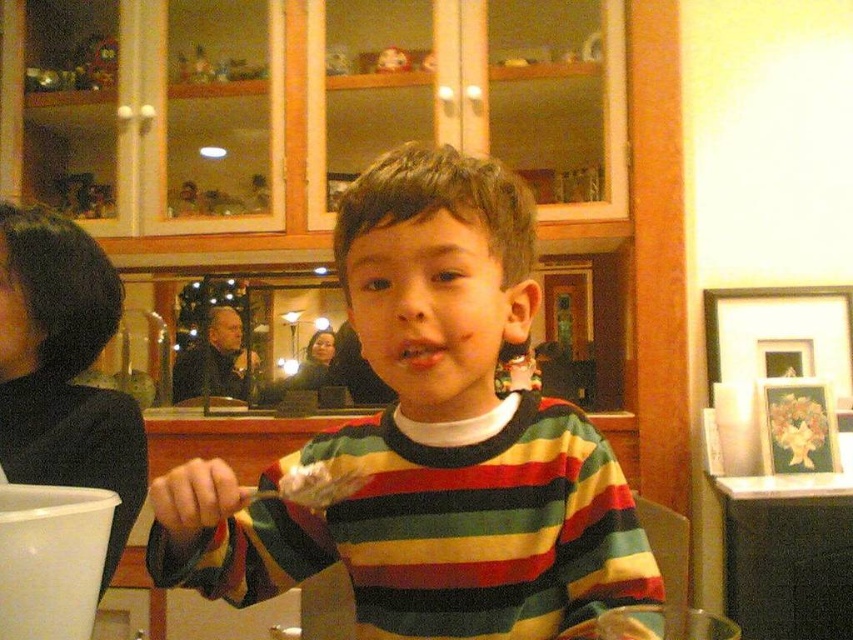
Question: Which point appears farthest from the camera in this image?

Choices:
 (A) (335, 481)
 (B) (262, 577)

Answer: (B)

Question: Which point is closer to the camera taking this photo?

Choices:
 (A) [482, 250]
 (B) [294, 472]

Answer: (A)

Question: Is striped cotton shirt at center to the left of white creamy food at center from the viewer's perspective?

Choices:
 (A) yes
 (B) no

Answer: (B)

Question: Which point appears closest to the camera in this image?

Choices:
 (A) (438, 291)
 (B) (334, 493)

Answer: (B)

Question: Can you confirm if striped cotton shirt at center is bigger than white creamy food at center?

Choices:
 (A) no
 (B) yes

Answer: (B)

Question: Is striped cotton shirt at center smaller than white creamy food at center?

Choices:
 (A) yes
 (B) no

Answer: (B)